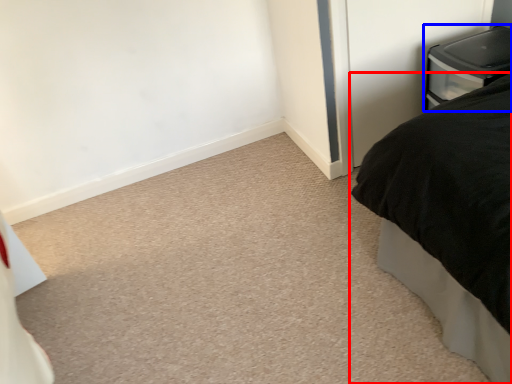
Question: Which point is further to the camera, bed (highlighted by a red box) or furniture (highlighted by a blue box)?

Choices:
 (A) bed
 (B) furniture

Answer: (B)